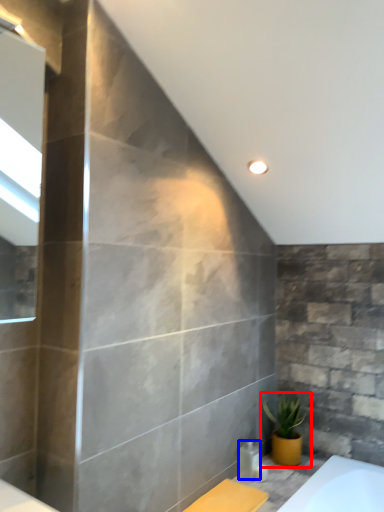
Question: Which object appears closest to the camera in this image, houseplant (highlighted by a red box) or toiletry (highlighted by a blue box)?

Choices:
 (A) houseplant
 (B) toiletry

Answer: (B)